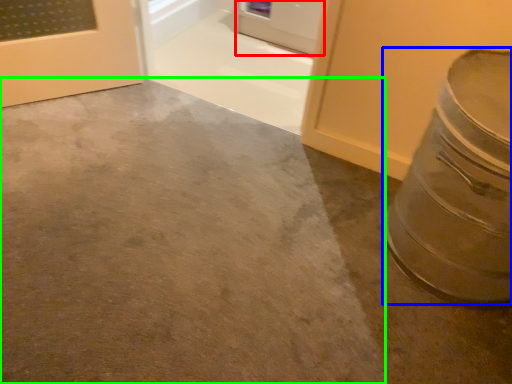
Question: Which is farther away from door (highlighted by a red box)? crock pot (highlighted by a blue box) or concrete (highlighted by a green box)?

Choices:
 (A) crock pot
 (B) concrete

Answer: (A)